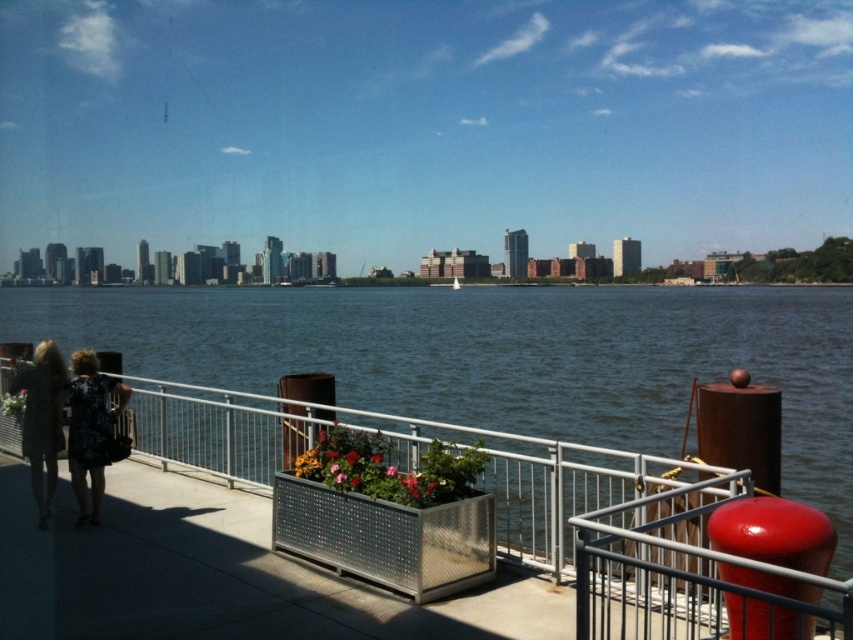
Is black floral dress at lower left wider than printed fabric dress at lower left?

Yes.

Who is more forward, (83, 396) or (38, 348)?

Point (83, 396) is in front.

Find the location of a particular element. This screenshot has width=853, height=640. black floral dress at lower left is located at coordinates (90, 429).

Based on the photo, is metallic water at center positioned behind black floral dress at lower left?

That is True.

From the picture: Is metallic water at center to the left of black floral dress at lower left from the viewer's perspective?

Correct, you'll find metallic water at center to the left of black floral dress at lower left.

Describe the element at coordinates (498, 356) in the screenshot. I see `metallic water at center` at that location.

Image resolution: width=853 pixels, height=640 pixels. Find the location of `metallic water at center`. metallic water at center is located at coordinates (498, 356).

Between point (621, 419) and point (47, 360), which one is positioned behind?

Positioned behind is point (621, 419).

Which is above, metallic water at center or printed fabric dress at lower left?

metallic water at center is higher up.

Does point (558, 372) come closer to viewer compared to point (65, 380)?

No, (558, 372) is further to viewer.

Find the location of a particular element. metallic water at center is located at coordinates (498, 356).